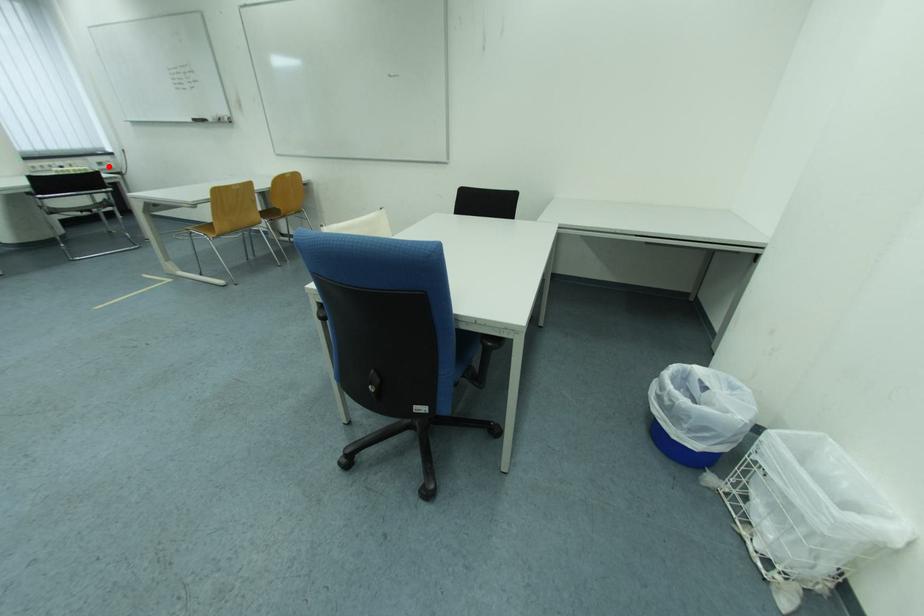
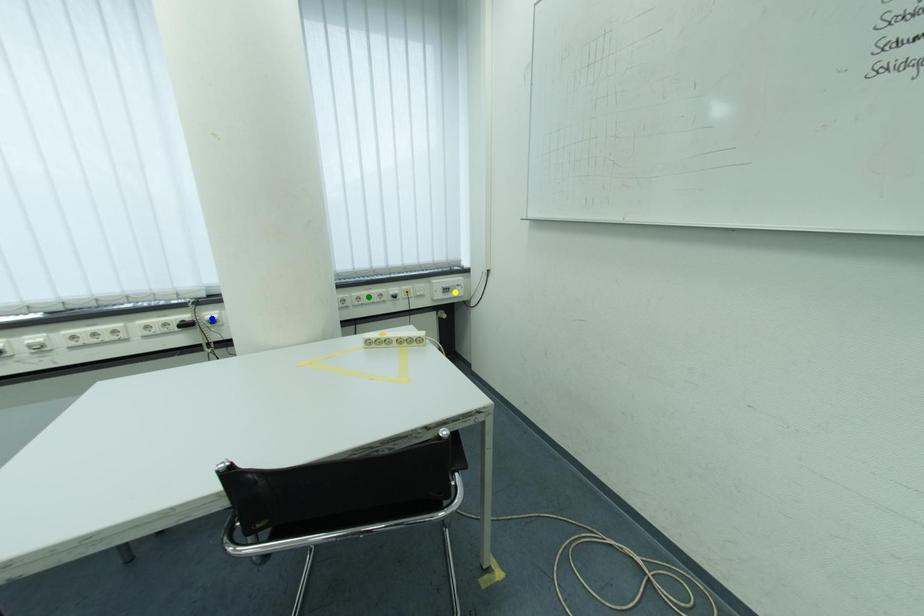
Question: I am providing you with two images of the same scene from different viewpoints. A red point is marked on the first image. You are given multiple points on the second image. Can you choose the point in image 2 that corresponds to the point in image 1?

Choices:
 (A) blue point
 (B) yellow point
 (C) green point

Answer: (B)